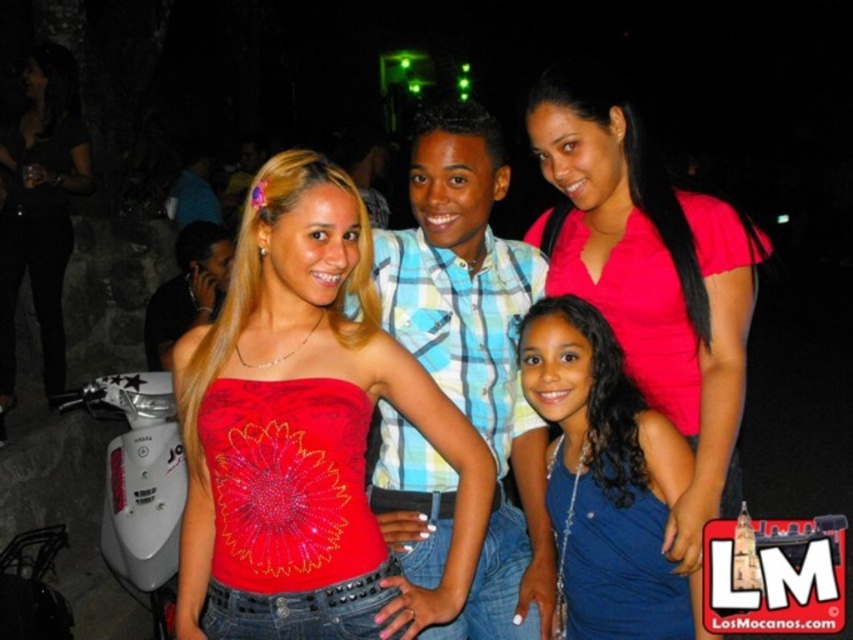
Question: Does blue satin dress at lower right appear on the left side of matte black dress at center?

Choices:
 (A) no
 (B) yes

Answer: (A)

Question: Which object appears farthest from the camera in this image?

Choices:
 (A) shiny red fabric top at center
 (B) matte black dress at center
 (C) pink satin blouse at upper right

Answer: (B)

Question: Which of the following is the closest to the observer?

Choices:
 (A) (718, 467)
 (B) (572, 557)
 (C) (9, 164)
 (D) (341, 200)

Answer: (D)

Question: Based on their relative distances, which object is farther from the blue satin dress at lower right?

Choices:
 (A) pink satin blouse at upper right
 (B) matte black dress at center

Answer: (B)

Question: Can you confirm if pink satin blouse at upper right is positioned above blue satin dress at lower right?

Choices:
 (A) no
 (B) yes

Answer: (B)

Question: Is shiny red fabric top at center below matte black dress at center?

Choices:
 (A) no
 (B) yes

Answer: (B)